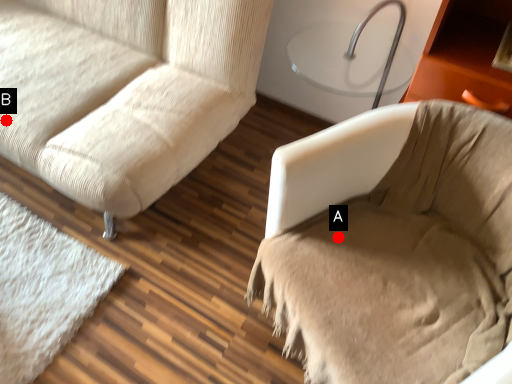
Question: Two points are circled on the image, labeled by A and B beside each circle. Among these points, which one is nearest to the camera?

Choices:
 (A) A is closer
 (B) B is closer

Answer: (A)